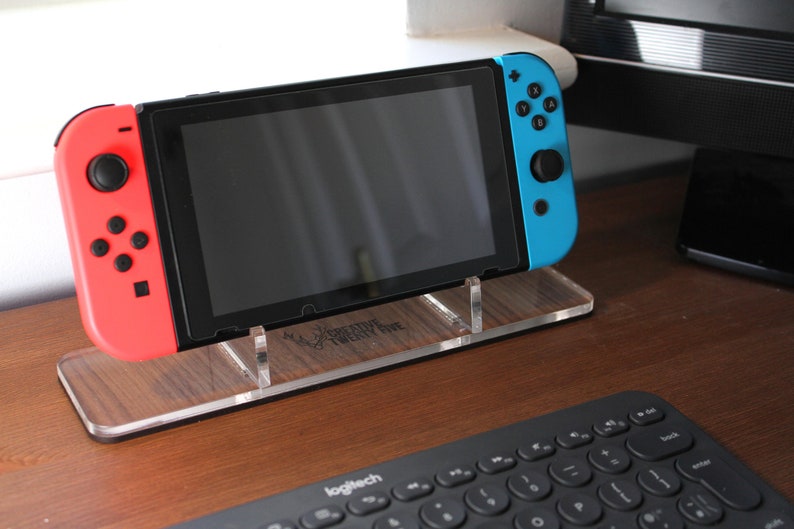
This screenshot has width=794, height=529. Identify the location of keyboard. (538, 456).